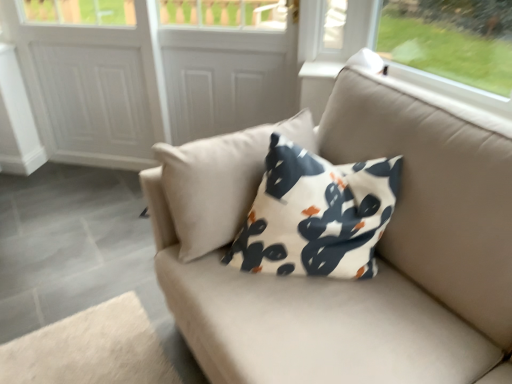
What is the approximate width of white matte screen door at upper center, which is the second screen door from right to left?

It is 3.39 inches.

Consider the image. How much space does white matte screen door at upper center, which is the second screen door from right to left, occupy vertically?

1.07 meters.

Consider the image. Measure the distance between white matte door at center, the 3th screen door when ordered from left to right, and camera.

white matte door at center, the 3th screen door when ordered from left to right, is 2.16 meters from camera.

The image size is (512, 384). Describe the element at coordinates (92, 104) in the screenshot. I see `white textured screen door at upper center, which ranks as the third screen door in right-to-left order` at that location.

Find the location of a particular element. The height and width of the screenshot is (384, 512). white matte screen door at upper center, which is the second screen door from right to left is located at coordinates (150, 72).

Could you tell me if white matte screen door at upper center, positioned as the second screen door in left-to-right order, is facing white textured screen door at upper center, marked as the 1th screen door in a left-to-right arrangement?

Answer: Yes, white matte screen door at upper center, positioned as the second screen door in left-to-right order, faces towards white textured screen door at upper center, marked as the 1th screen door in a left-to-right arrangement.

Is white matte screen door at upper center, positioned as the second screen door in left-to-right order, thinner than white textured screen door at upper center, which ranks as the third screen door in right-to-left order?

Yes, white matte screen door at upper center, positioned as the second screen door in left-to-right order, is thinner than white textured screen door at upper center, which ranks as the third screen door in right-to-left order.

Which is in front, point (209, 54) or point (85, 121)?

The point (209, 54) is more forward.

How much distance is there between white matte screen door at upper center, positioned as the second screen door in left-to-right order, and white textured screen door at upper center, marked as the 1th screen door in a left-to-right arrangement?

The distance of white matte screen door at upper center, positioned as the second screen door in left-to-right order, from white textured screen door at upper center, marked as the 1th screen door in a left-to-right arrangement, is 4.61 inches.

Measure the distance from white matte door at center, acting as the first screen door starting from the right, to white textured screen door at upper center, marked as the 1th screen door in a left-to-right arrangement.

white matte door at center, acting as the first screen door starting from the right, is 19.65 inches from white textured screen door at upper center, marked as the 1th screen door in a left-to-right arrangement.

Does white matte door at center, acting as the first screen door starting from the right, turn towards white textured screen door at upper center, marked as the 1th screen door in a left-to-right arrangement?

No, white matte door at center, acting as the first screen door starting from the right, is not facing towards white textured screen door at upper center, marked as the 1th screen door in a left-to-right arrangement.

Is white textured screen door at upper center, marked as the 1th screen door in a left-to-right arrangement, surrounded by white matte door at center, acting as the first screen door starting from the right?

No, white textured screen door at upper center, marked as the 1th screen door in a left-to-right arrangement, is not surrounded by white matte door at center, acting as the first screen door starting from the right.

Considering the sizes of white matte door at center, the 3th screen door when ordered from left to right, and white textured screen door at upper center, marked as the 1th screen door in a left-to-right arrangement, in the image, is white matte door at center, the 3th screen door when ordered from left to right, taller or shorter than white textured screen door at upper center, marked as the 1th screen door in a left-to-right arrangement,?

Clearly, white matte door at center, the 3th screen door when ordered from left to right, is shorter compared to white textured screen door at upper center, marked as the 1th screen door in a left-to-right arrangement.

Consider the image. From a real-world perspective, which object stands above the other?

white matte door at center, acting as the first screen door starting from the right, from a real-world perspective.

From the image's perspective, is white matte screen door at upper center, positioned as the second screen door in left-to-right order, beneath white matte door at center, acting as the first screen door starting from the right?

Indeed, from the image's perspective, white matte screen door at upper center, positioned as the second screen door in left-to-right order, is shown beneath white matte door at center, acting as the first screen door starting from the right.

Is point (95, 149) closer to viewer compared to point (245, 87)?

No, (95, 149) is behind (245, 87).

Considering the positions of objects white matte screen door at upper center, which is the second screen door from right to left, and white matte door at center, the 3th screen door when ordered from left to right, in the image provided, who is more to the right, white matte screen door at upper center, which is the second screen door from right to left, or white matte door at center, the 3th screen door when ordered from left to right,?

Positioned to the right is white matte door at center, the 3th screen door when ordered from left to right.

Between white matte door at center, the 3th screen door when ordered from left to right, and white matte screen door at upper center, which is the second screen door from right to left, which one is positioned in front?

white matte door at center, the 3th screen door when ordered from left to right, is closer to the camera.

Are white matte door at center, acting as the first screen door starting from the right, and white matte screen door at upper center, positioned as the second screen door in left-to-right order, making contact?

No, white matte door at center, acting as the first screen door starting from the right, is not making contact with white matte screen door at upper center, positioned as the second screen door in left-to-right order.

Would you say white matte screen door at upper center, which is the second screen door from right to left, is part of white matte door at center, the 3th screen door when ordered from left to right,'s contents?

Yes.

The image size is (512, 384). I want to click on screen door below the white matte door at center, acting as the first screen door starting from the right (from the image's perspective), so click(x=150, y=72).

Is white textured screen door at upper center, which ranks as the third screen door in right-to-left order, completely or partially outside of white matte door at center, acting as the first screen door starting from the right?

Yes, white textured screen door at upper center, which ranks as the third screen door in right-to-left order, is not within white matte door at center, acting as the first screen door starting from the right.

Does point (48, 47) lie in front of point (183, 16)?

No, it is not.

Can you confirm if white textured screen door at upper center, marked as the 1th screen door in a left-to-right arrangement, is positioned to the left of white matte screen door at upper center, which is the second screen door from right to left?

Correct, you'll find white textured screen door at upper center, marked as the 1th screen door in a left-to-right arrangement, to the left of white matte screen door at upper center, which is the second screen door from right to left.

How different are the orientations of white textured screen door at upper center, which ranks as the third screen door in right-to-left order, and white matte screen door at upper center, which is the second screen door from right to left, in degrees?

There is a 1.14-degree angle between the facing directions of white textured screen door at upper center, which ranks as the third screen door in right-to-left order, and white matte screen door at upper center, which is the second screen door from right to left.

Is white textured screen door at upper center, which ranks as the third screen door in right-to-left order, not inside white matte screen door at upper center, positioned as the second screen door in left-to-right order?

Actually, white textured screen door at upper center, which ranks as the third screen door in right-to-left order, is within white matte screen door at upper center, positioned as the second screen door in left-to-right order.

Is white textured screen door at upper center, marked as the 1th screen door in a left-to-right arrangement, further to camera compared to white matte screen door at upper center, which is the second screen door from right to left?

Yes, white textured screen door at upper center, marked as the 1th screen door in a left-to-right arrangement, is further from the camera.

There is a white textured screen door at upper center, which ranks as the third screen door in right-to-left order. At what (x,y) coordinates should I click in order to perform the action: click on the 2nd screen door below it (from the image's perspective). Please return your answer as a coordinate pair (x, y). The image size is (512, 384). Looking at the image, I should click on (150, 72).

You are a GUI agent. You are given a task and a screenshot of the screen. Output one action in this format:
    pyautogui.click(x=<x>, y=<y>)
    Task: Click on the screen door that is the 2nd object located behind the white matte door at center, the 3th screen door when ordered from left to right
    The image size is (512, 384).
    Given the screenshot: What is the action you would take?
    pyautogui.click(x=92, y=104)

From the picture: When comparing their distances from white matte screen door at upper center, positioned as the second screen door in left-to-right order, does white textured screen door at upper center, marked as the 1th screen door in a left-to-right arrangement, or white matte door at center, the 3th screen door when ordered from left to right, seem closer?

white textured screen door at upper center, marked as the 1th screen door in a left-to-right arrangement.

Considering their positions, is white matte screen door at upper center, positioned as the second screen door in left-to-right order, positioned closer to white textured screen door at upper center, which ranks as the third screen door in right-to-left order, than white matte door at center, acting as the first screen door starting from the right?

white matte screen door at upper center, positioned as the second screen door in left-to-right order, is positioned closer to the anchor white textured screen door at upper center, which ranks as the third screen door in right-to-left order.

Based on their spatial positions, is white matte screen door at upper center, positioned as the second screen door in left-to-right order, or white textured screen door at upper center, marked as the 1th screen door in a left-to-right arrangement, closer to white matte door at center, acting as the first screen door starting from the right?

Based on the image, white matte screen door at upper center, positioned as the second screen door in left-to-right order, appears to be nearer to white matte door at center, acting as the first screen door starting from the right.

When comparing their distances from white textured screen door at upper center, which ranks as the third screen door in right-to-left order, does white matte door at center, acting as the first screen door starting from the right, or white matte screen door at upper center, which is the second screen door from right to left, seem further?

Based on the image, white matte door at center, acting as the first screen door starting from the right, appears to be further to white textured screen door at upper center, which ranks as the third screen door in right-to-left order.

Which object lies nearer to the anchor point white matte screen door at upper center, which is the second screen door from right to left, white matte door at center, acting as the first screen door starting from the right, or white textured screen door at upper center, which ranks as the third screen door in right-to-left order?

white textured screen door at upper center, which ranks as the third screen door in right-to-left order, is positioned closer to the anchor white matte screen door at upper center, which is the second screen door from right to left.

Based on the photo, from the image, which object appears to be nearer to white matte door at center, acting as the first screen door starting from the right, white textured screen door at upper center, marked as the 1th screen door in a left-to-right arrangement, or white matte screen door at upper center, positioned as the second screen door in left-to-right order?

Among the two, white matte screen door at upper center, positioned as the second screen door in left-to-right order, is located nearer to white matte door at center, acting as the first screen door starting from the right.

Image resolution: width=512 pixels, height=384 pixels. Identify the location of screen door located between white textured screen door at upper center, marked as the 1th screen door in a left-to-right arrangement, and white matte door at center, acting as the first screen door starting from the right, in the left-right direction. (150, 72).